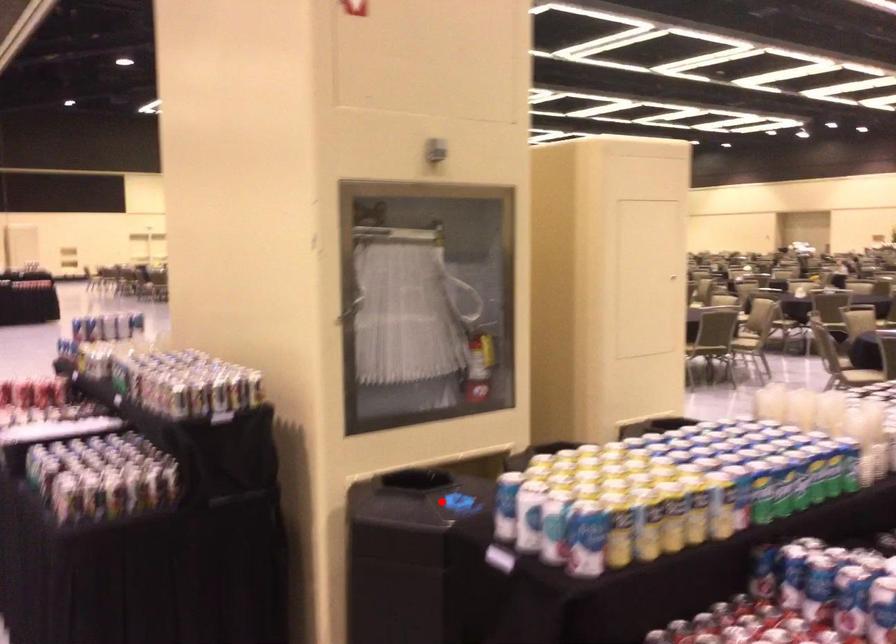
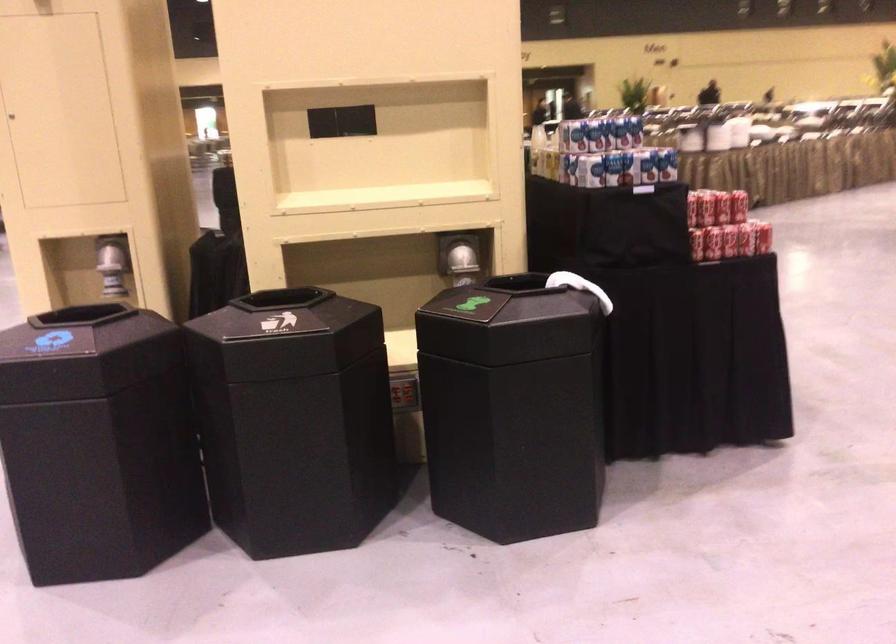
Question: I am providing you with two images of the same scene from different viewpoints. A red point is marked on the first image. Is the red point's position out of view in image 2?

Choices:
 (A) Yes
 (B) No

Answer: (A)